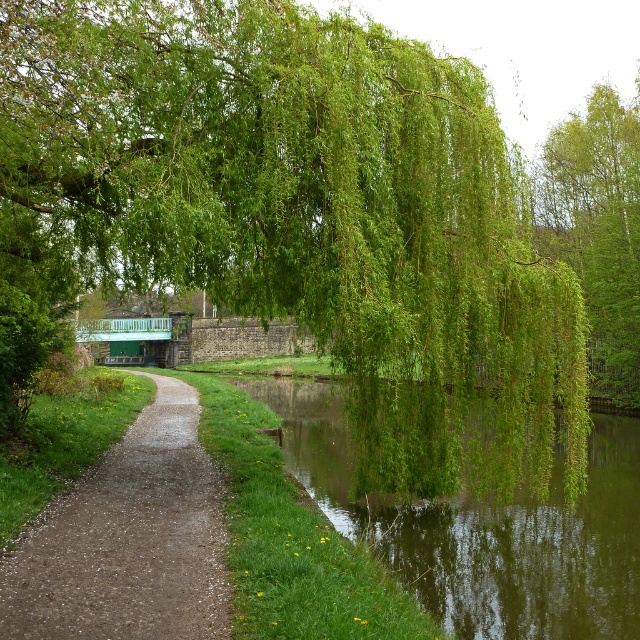
You are a landscape architect designing a new park. You want to place a small bench so that visitors can enjoy the view of both the green leafy willow at upper center and the green leafy river at center. Based on their sizes, which object should the bench be closer to?

The bench should be closer to the green leafy river at center because the green leafy willow at upper center is larger in size, so positioning the bench closer to the smaller river allows visitors to see both objects comfortably without one overshadowing the other.

You are planning to place a 2 meter wide bench along the gravel path near the green leafy willow at upper center and the green leafy river at center. Based on their widths, which object can accommodate the bench without overlapping?

The green leafy river at center has a greater width than the green leafy willow at upper center, so the bench can be placed along the gravel path near the green leafy river at center without overlapping.